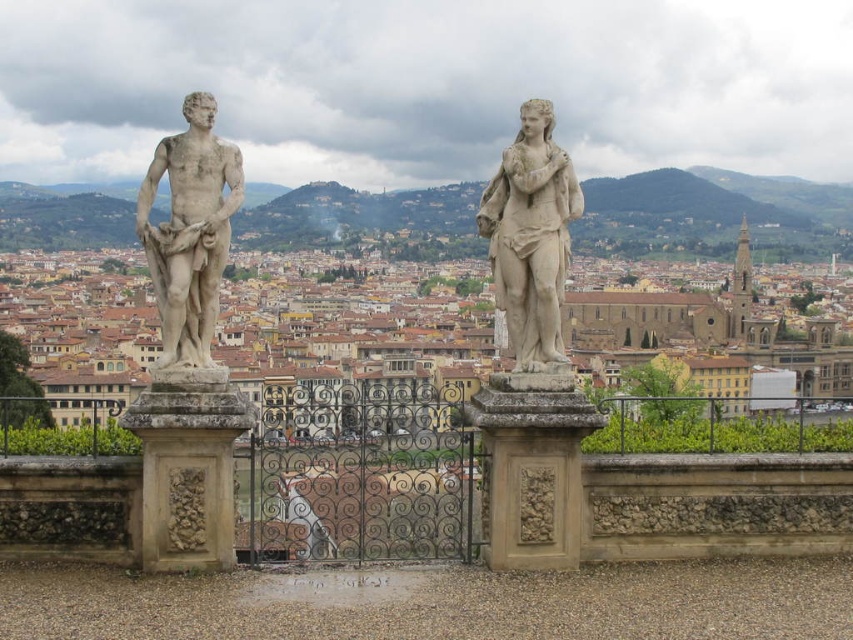
Question: Which point is closer to the camera?

Choices:
 (A) (218, 228)
 (B) (527, 184)

Answer: (B)

Question: Does white marble statue at left have a smaller size compared to white marble statue at center?

Choices:
 (A) no
 (B) yes

Answer: (B)

Question: Can you confirm if white marble statue at left is wider than white marble statue at center?

Choices:
 (A) yes
 (B) no

Answer: (B)

Question: Which point appears farthest from the camera in this image?

Choices:
 (A) (187, 195)
 (B) (544, 100)

Answer: (B)

Question: Among these points, which one is farthest from the camera?

Choices:
 (A) (187, 163)
 (B) (550, 225)

Answer: (B)

Question: Is white marble statue at left wider than white marble statue at center?

Choices:
 (A) yes
 (B) no

Answer: (B)